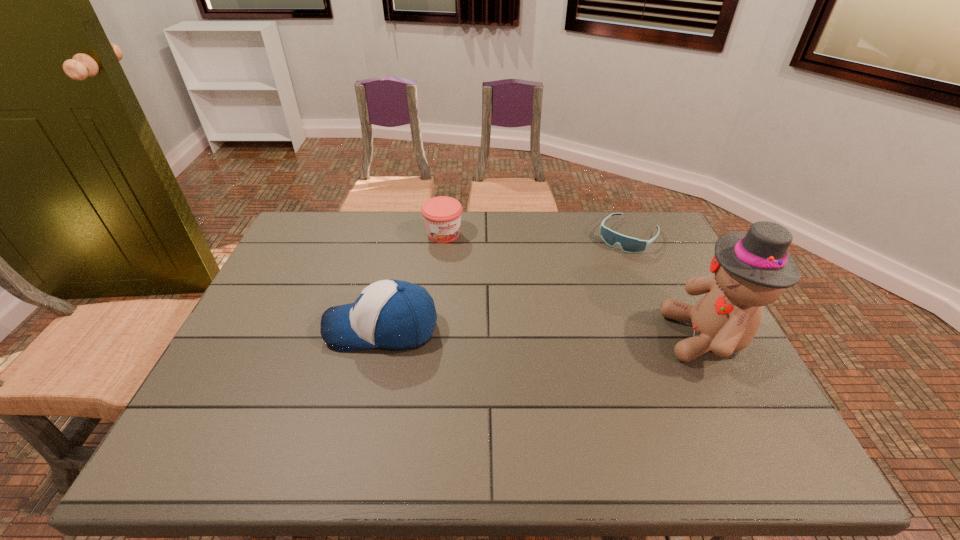
The height and width of the screenshot is (540, 960). I want to click on baseball cap, so click(392, 314).

Locate an element on the screen. the tallest object is located at coordinates (751, 269).

Locate an element on the screen. the shortest object is located at coordinates (628, 244).

You are a GUI agent. You are given a task and a screenshot of the screen. Output one action in this format:
    pyautogui.click(x=<x>, y=<y>)
    Task: Click on the second shortest object
    Image resolution: width=960 pixels, height=540 pixels.
    Given the screenshot: What is the action you would take?
    pyautogui.click(x=442, y=215)

Identify the location of vacant area situated 0.130m on the front-facing side of the baseball cap. Image resolution: width=960 pixels, height=540 pixels. (276, 329).

Locate an element on the screen. vacant space located on the front-facing side of the baseball cap is located at coordinates (299, 329).

This screenshot has width=960, height=540. Find the location of `vacant area located 0.180m on the front-facing side of the baseball cap`. vacant area located 0.180m on the front-facing side of the baseball cap is located at coordinates (256, 329).

This screenshot has height=540, width=960. In order to click on vacant space located on the front-facing side of the rag_doll in this screenshot , I will do `click(586, 337)`.

Locate an element on the screen. The width and height of the screenshot is (960, 540). free region located on the front-facing side of the rag_doll is located at coordinates (621, 337).

Where is `vacant space located 0.100m on the front-facing side of the rag_doll`? vacant space located 0.100m on the front-facing side of the rag_doll is located at coordinates (625, 337).